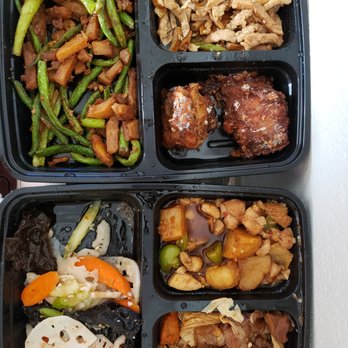
Where is `walls between sections`? This screenshot has height=348, width=348. walls between sections is located at coordinates (228, 57), (140, 16), (146, 122), (148, 229), (192, 303), (146, 341).